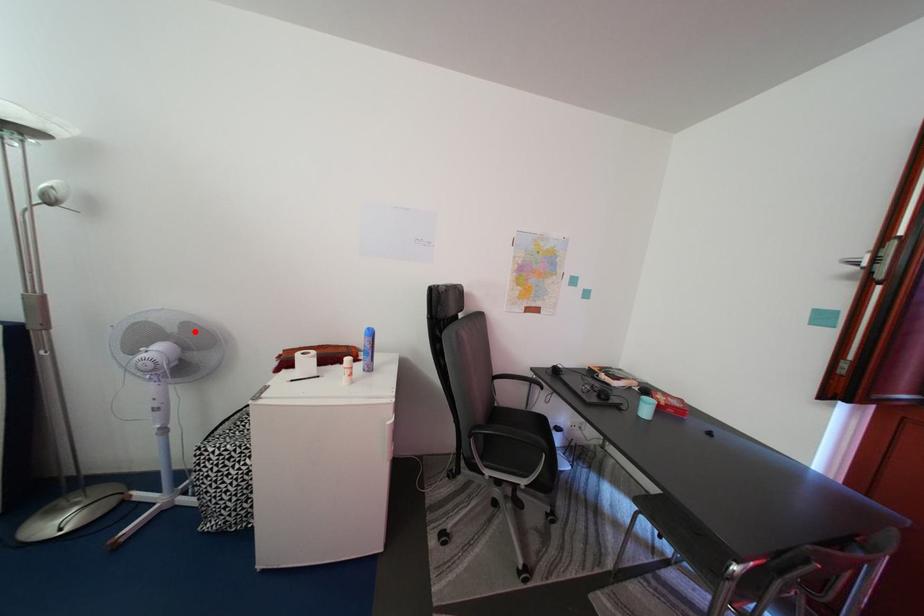
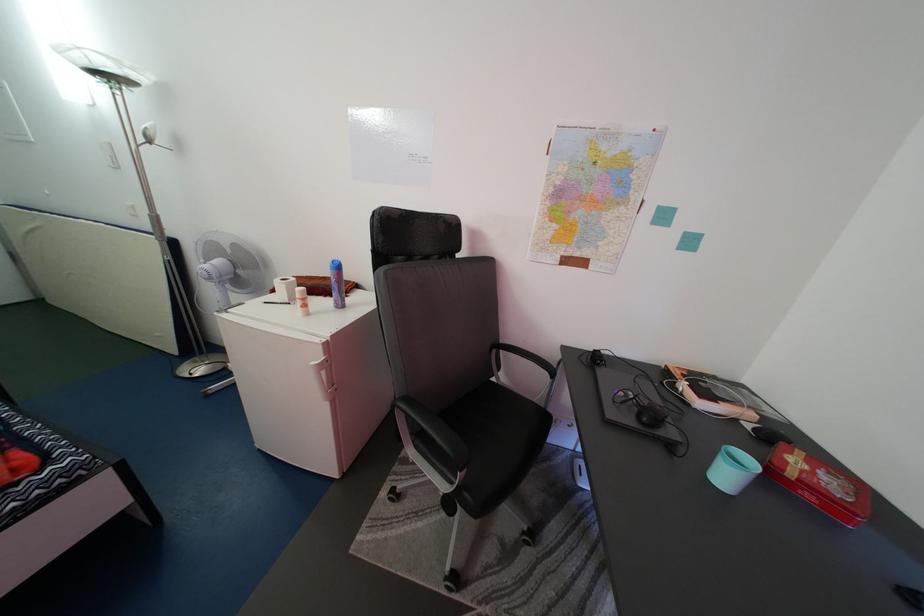
Locate, in the second image, the point that corresponds to the highlighted location in the first image.

(244, 253)